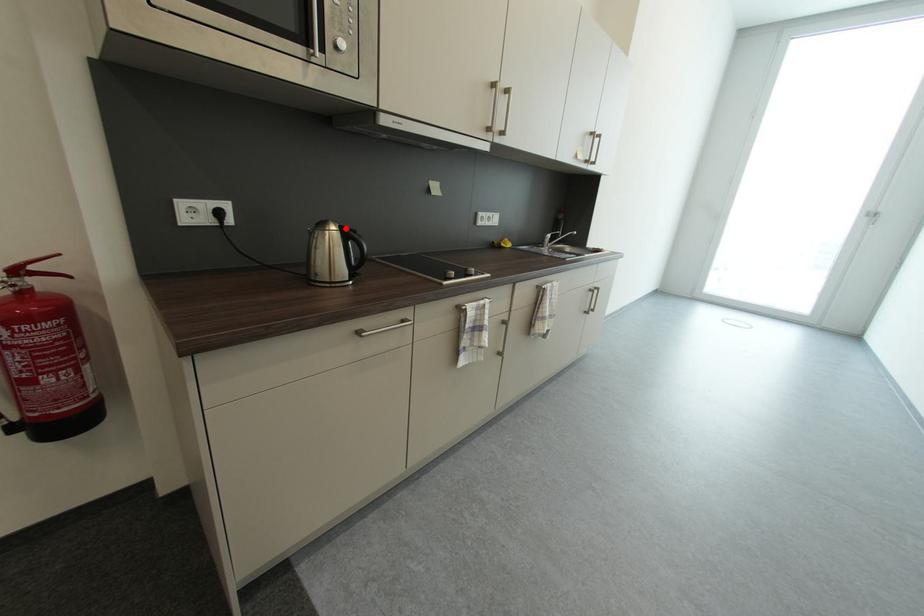
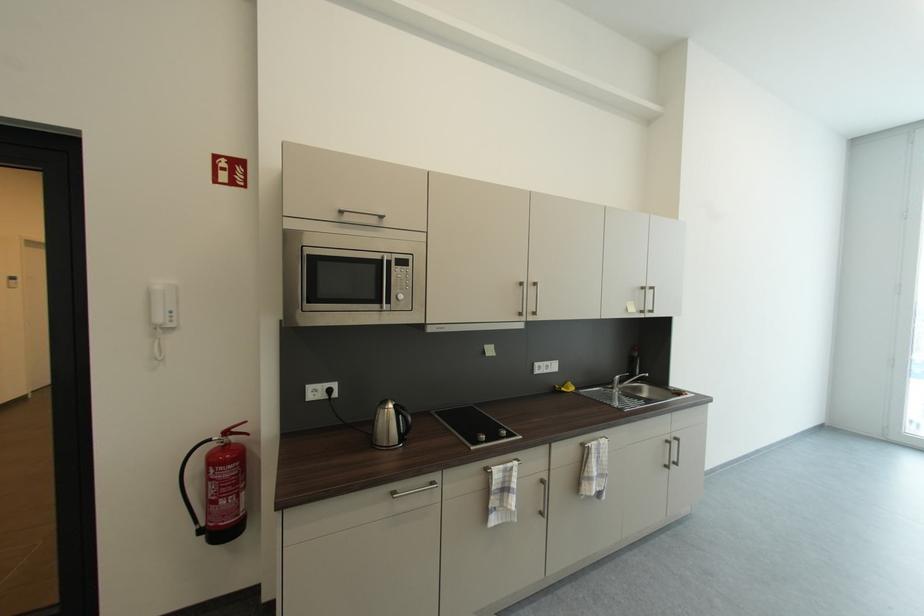
Question: I am providing you with two images of the same scene from different viewpoints. A red point is marked on the first image. At the location where the point appears in image 1, is it still visible in image 2?

Choices:
 (A) Yes
 (B) No

Answer: (A)